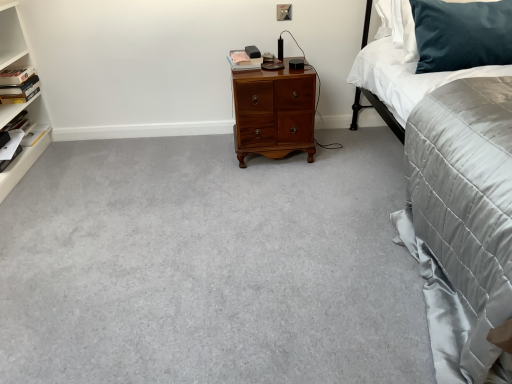
Question: Looking at the image, does matte pink book at center, which is counted as the 1th book, starting from the top, seem bigger or smaller compared to satin grey quilt at right?

Choices:
 (A) small
 (B) big

Answer: (A)

Question: From a real-world perspective, is matte pink book at center, placed as the third book when sorted from bottom to top, positioned above or below satin grey quilt at right?

Choices:
 (A) below
 (B) above

Answer: (B)

Question: Based on their relative distances, which object is farther from the white satin sheet at upper right?

Choices:
 (A) satin grey quilt at right
 (B) shiny brown wooden nightstand at center
 (C) gray carpet at center
 (D) matte pink book at center, placed as the third book when sorted from bottom to top
 (E) white paper at left, which is the second book from left to right

Answer: (E)

Question: Which is farther from the dark blue velvet pillow at upper right?

Choices:
 (A) white paper at left, marked as the 3th book in a top-to-bottom arrangement
 (B) matte pink book at center, placed as the third book when sorted from bottom to top
 (C) satin grey quilt at right
 (D) shiny brown wooden nightstand at center
 (E) white satin sheet at upper right

Answer: (A)